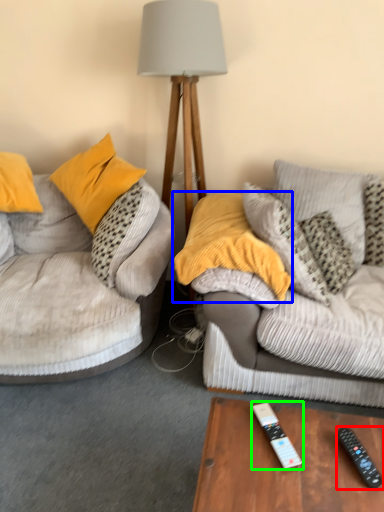
Question: Based on their relative distances, which object is nearer to remote control (highlighted by a red box)? Choose from pillow (highlighted by a blue box) and remote control (highlighted by a green box).

Choices:
 (A) pillow
 (B) remote control

Answer: (B)